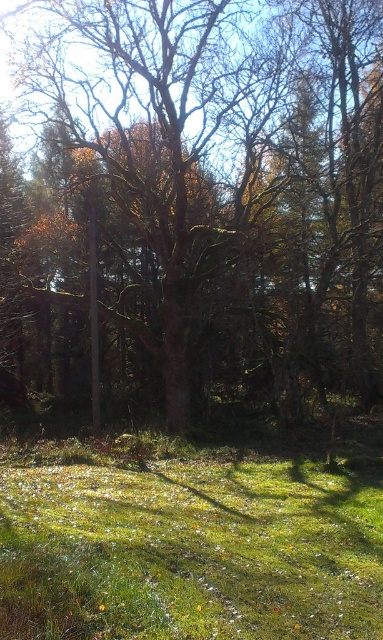
Question: Which of the following is the closest to the observer?

Choices:
 (A) green grassy field at lower center
 (B) brown rough tree at center

Answer: (A)

Question: Considering the relative positions of brown rough tree at center and green grassy field at lower center in the image provided, where is brown rough tree at center located with respect to green grassy field at lower center?

Choices:
 (A) left
 (B) right

Answer: (B)

Question: Which object appears farthest from the camera in this image?

Choices:
 (A) green grassy field at lower center
 (B) brown rough tree at center

Answer: (B)

Question: Does brown rough tree at center have a smaller size compared to green grassy field at lower center?

Choices:
 (A) yes
 (B) no

Answer: (B)

Question: Which of the following is the closest to the observer?

Choices:
 (A) green grassy field at lower center
 (B) brown rough tree at center

Answer: (A)

Question: Is brown rough tree at center to the left of green grassy field at lower center from the viewer's perspective?

Choices:
 (A) no
 (B) yes

Answer: (A)